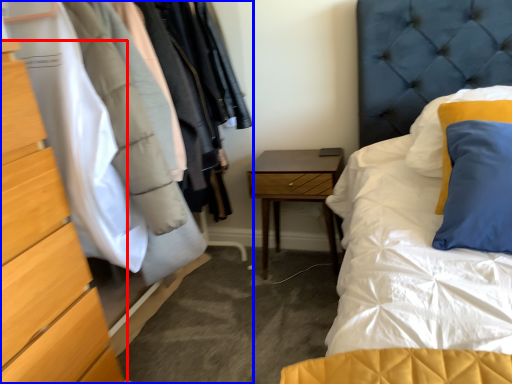
Question: Which point is further to the camera, chest of drawers (highlighted by a red box) or dresser (highlighted by a blue box)?

Choices:
 (A) chest of drawers
 (B) dresser

Answer: (B)